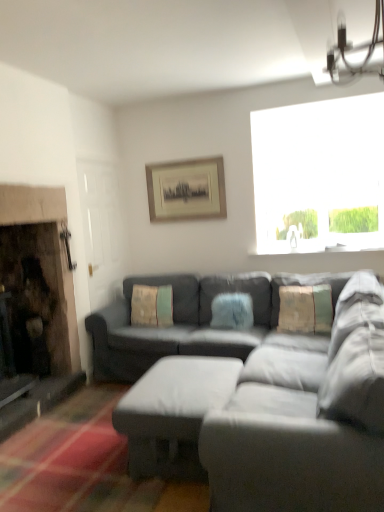
Question: In terms of size, does matte gray couch at center appear bigger or smaller than white plastic light fixture at upper right?

Choices:
 (A) big
 (B) small

Answer: (A)

Question: Considering the positions of point (226, 379) and point (362, 74), is point (226, 379) closer or farther from the camera than point (362, 74)?

Choices:
 (A) closer
 (B) farther

Answer: (B)

Question: Considering the real-world distances, which object is closest to the textured beige pillow at center, arranged as the first pillow when viewed from the left?

Choices:
 (A) fuzzy blue pillow at center, acting as the second pillow starting from the right
 (B) white plastic light fixture at upper right
 (C) textured beige pillow at center, placed as the third pillow when sorted from left to right
 (D) transparent glass window at upper right
 (E) matte black picture frame at upper center

Answer: (A)

Question: Considering the real-world distances, which object is farthest from the white plastic light fixture at upper right?

Choices:
 (A) textured beige pillow at center, the 3th pillow positioned from the right
 (B) textured beige pillow at center, which appears as the 1th pillow when viewed from the right
 (C) transparent glass window at upper right
 (D) matte gray ottoman at center
 (E) fuzzy blue pillow at center, which is the second pillow in left-to-right order

Answer: (A)